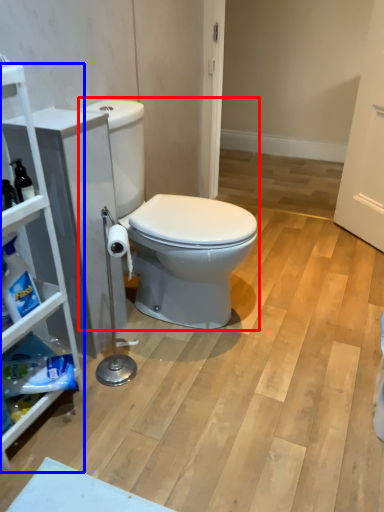
Question: Which of the following is the closest to the observer, toilet (highlighted by a red box) or cabinetry (highlighted by a blue box)?

Choices:
 (A) toilet
 (B) cabinetry

Answer: (B)